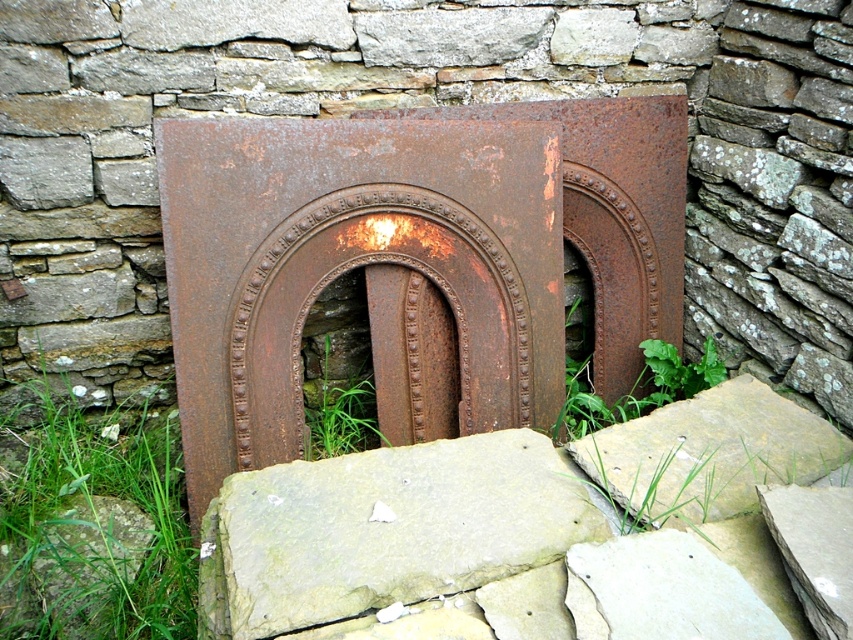
You are standing at the base of the metal archway and want to place two markers at the coordinates point (149, 560) and point (318, 456). Which marker will be closer to you when viewed from your current position?

Point (149, 560) is in front of point (318, 456), so the marker at point (149, 560) will be closer to you.

In the scene shown: You are standing in front of the metal archway and want to walk towards the green grass at center. Which direction should you move to avoid stepping on the green grass at lower left?

Since the green grass at lower left is in front of the green grass at center, you should move to the right or left to avoid stepping on the green grass at lower left while walking towards the green grass at center.